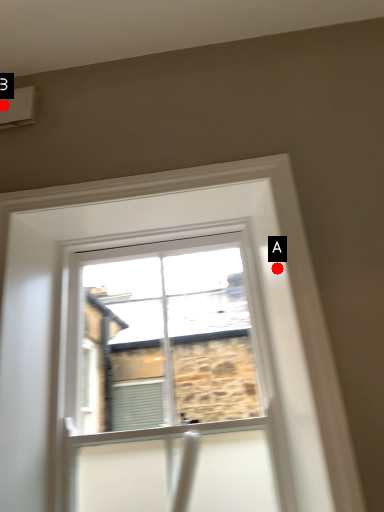
Question: Two points are circled on the image, labeled by A and B beside each circle. Which of the following is the closest to the observer?

Choices:
 (A) A is closer
 (B) B is closer

Answer: (A)